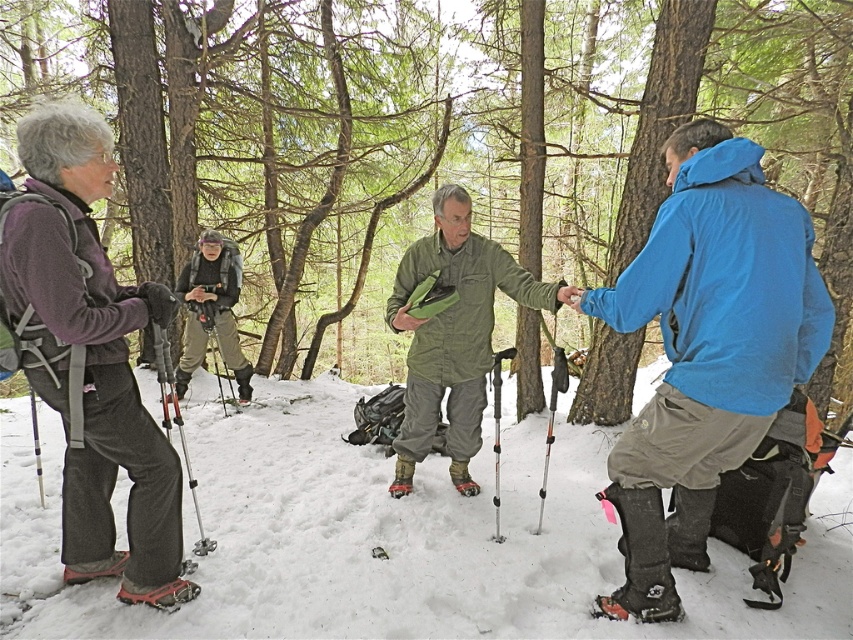
Is green fabric bag at center in front of brushed metal backpack at center?

Yes.

Does green fabric bag at center have a lesser width compared to brushed metal backpack at center?

Incorrect, green fabric bag at center's width is not less than brushed metal backpack at center's.

Is point (450, 257) positioned in front of point (202, 346)?

That is True.

This screenshot has height=640, width=853. In order to click on green fabric bag at center in this screenshot , I will do tap(453, 333).

Does white fluffy snow at center have a greater height compared to matte purple jacket at left?

No, white fluffy snow at center is not taller than matte purple jacket at left.

Consider the image. Can you confirm if white fluffy snow at center is wider than matte purple jacket at left?

Indeed, white fluffy snow at center has a greater width compared to matte purple jacket at left.

At what (x,y) coordinates should I click in order to perform the action: click on white fluffy snow at center. Please return your answer as a coordinate pair (x, y). The width and height of the screenshot is (853, 640). Looking at the image, I should click on (392, 538).

I want to click on white fluffy snow at center, so click(392, 538).

Who is lower down, white fluffy snow at center or green fabric bag at center?

white fluffy snow at center is lower down.

Which is in front, point (271, 512) or point (419, 381)?

Point (271, 512) is more forward.

Who is more forward, (202,493) or (445,276)?

Point (445,276) is more forward.

Where is `white fluffy snow at center`? The width and height of the screenshot is (853, 640). white fluffy snow at center is located at coordinates (392, 538).